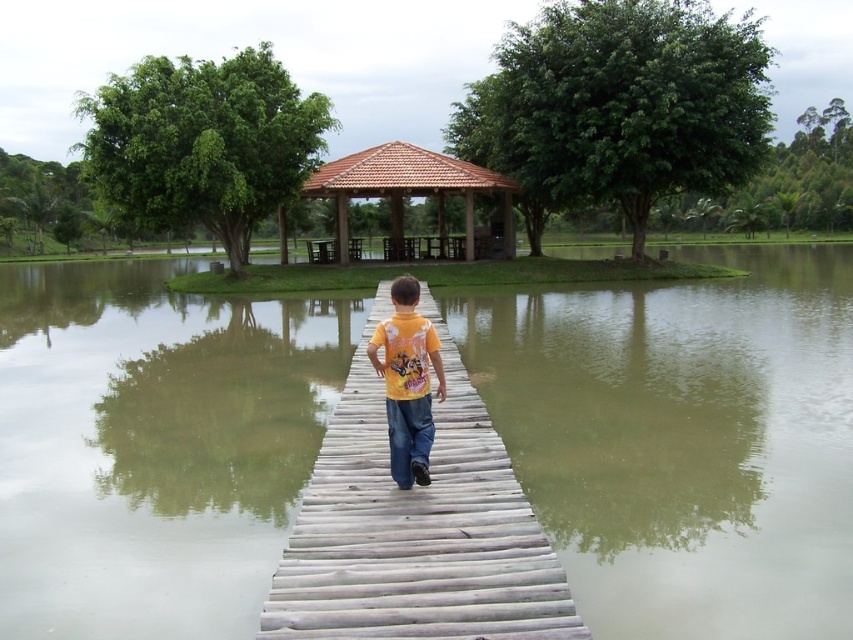
Can you confirm if wooden bridge at center is wider than yellow cotton shirt at center?

Correct, the width of wooden bridge at center exceeds that of yellow cotton shirt at center.

Does wooden bridge at center have a lesser height compared to yellow cotton shirt at center?

Yes, wooden bridge at center is shorter than yellow cotton shirt at center.

Is point (525, 515) closer to camera compared to point (422, 400)?

Yes, it is in front of point (422, 400).

In order to click on wooden bridge at center in this screenshot , I will do pyautogui.click(x=415, y=529).

Between point (851, 396) and point (556, 586), which one is positioned in front?

Point (556, 586) is in front.

Does point (35, 554) come behind point (363, 621)?

Yes, it is behind point (363, 621).

Describe the element at coordinates (683, 440) in the screenshot. This screenshot has height=640, width=853. I see `greenish-brown wooden bridge at center` at that location.

Locate an element on the screen. Image resolution: width=853 pixels, height=640 pixels. greenish-brown wooden bridge at center is located at coordinates (683, 440).

Does greenish-brown wooden bridge at center have a greater height compared to brown tiled gazebo at center?

In fact, greenish-brown wooden bridge at center may be shorter than brown tiled gazebo at center.

Between greenish-brown wooden bridge at center and brown tiled gazebo at center, which one is positioned lower?

Positioned lower is greenish-brown wooden bridge at center.

Locate an element on the screen. This screenshot has height=640, width=853. greenish-brown wooden bridge at center is located at coordinates (683, 440).